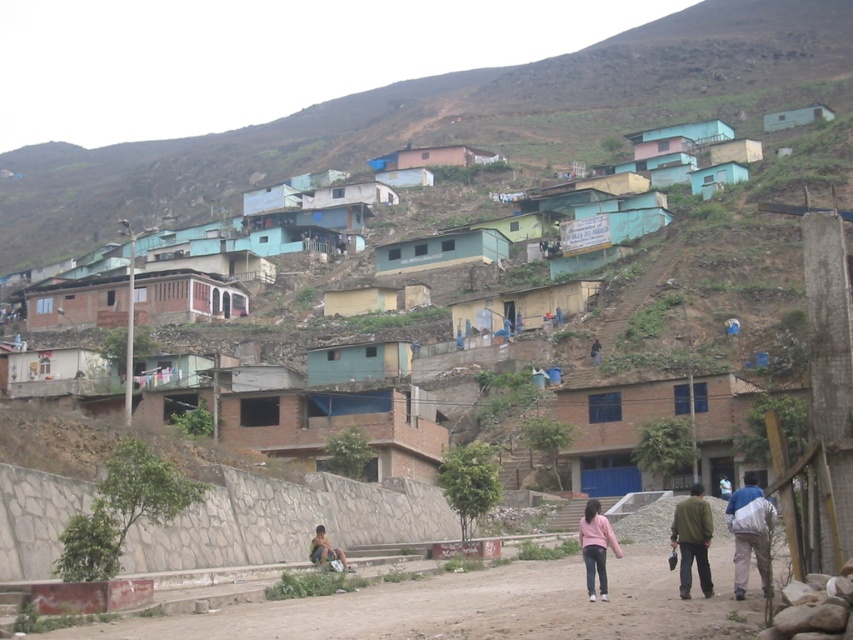
Can you confirm if brick wall house at center is positioned to the right of light blue corrugated metal hut at upper right?

No, brick wall house at center is not to the right of light blue corrugated metal hut at upper right.

What do you see at coordinates (186, 296) in the screenshot? I see `brick wall house at center` at bounding box center [186, 296].

Between point (164, 282) and point (814, 112), which one is positioned in front?

Positioned in front is point (164, 282).

Where is `brick wall house at center`? This screenshot has width=853, height=640. brick wall house at center is located at coordinates (186, 296).

Can you confirm if brown dirt track at lower center is taller than matte pink building at upper center?

Incorrect, brown dirt track at lower center's height is not larger of matte pink building at upper center's.

Which is more to the left, brown dirt track at lower center or matte pink building at upper center?

From the viewer's perspective, brown dirt track at lower center appears more on the left side.

Where is `brown dirt track at lower center`? The width and height of the screenshot is (853, 640). brown dirt track at lower center is located at coordinates (486, 604).

Identify the location of brown dirt track at lower center. This screenshot has width=853, height=640. (486, 604).

Can you confirm if light blue corrugated metal hut at upper right is positioned to the right of light blue shirt at center?

Correct, you'll find light blue corrugated metal hut at upper right to the right of light blue shirt at center.

Is point (779, 125) positioned in front of point (728, 490)?

That is False.

Image resolution: width=853 pixels, height=640 pixels. Identify the location of light blue corrugated metal hut at upper right. (796, 116).